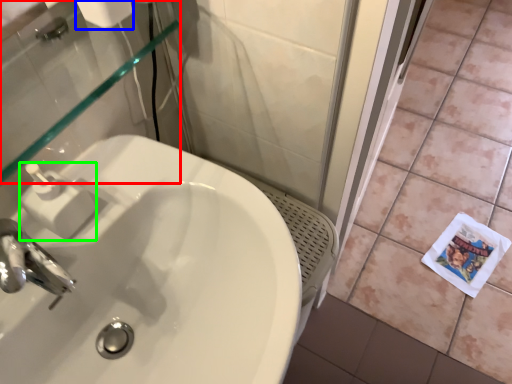
Question: Which object is positioned farthest from mirror (highlighted by a red box)? Select from toilet paper (highlighted by a blue box) and soap dispenser (highlighted by a green box).

Choices:
 (A) toilet paper
 (B) soap dispenser

Answer: (A)